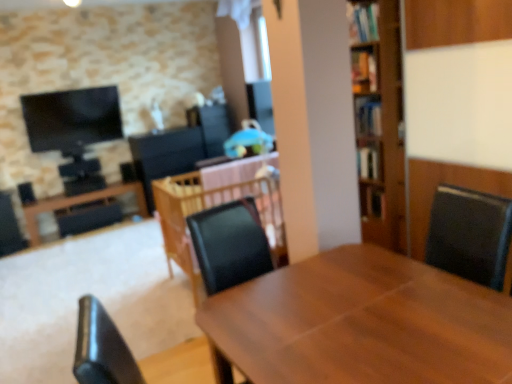
Question: Considering their positions, is wooden table at center, which is counted as the first table, starting from the right, located in front of or behind wooden table at center, placed as the 2th table when sorted from left to right?

Choices:
 (A) behind
 (B) front

Answer: (B)

Question: Considering the positions of wooden table at center, which is counted as the first table, starting from the right, and wooden table at center, the 2th table in the front-to-back sequence, in the image, is wooden table at center, which is counted as the first table, starting from the right, bigger or smaller than wooden table at center, the 2th table in the front-to-back sequence,?

Choices:
 (A) small
 (B) big

Answer: (B)

Question: Based on their relative distances, which object is farther from the wooden table at left, which ranks as the 1th table in left-to-right order?

Choices:
 (A) wooden table at center, the 2th table in the front-to-back sequence
 (B) wooden bookshelf at upper right, the 1th shelf positioned from the left
 (C) wooden table at center, marked as the 3th table in a back-to-front arrangement
 (D) wooden bookshelf at right, which ranks as the second shelf in left-to-right order

Answer: (C)

Question: Considering the real-world distances, which object is farthest from the wooden bookshelf at upper right, marked as the second shelf in a right-to-left arrangement?

Choices:
 (A) wooden table at center, the 2th table in the front-to-back sequence
 (B) wooden bookshelf at right, which ranks as the second shelf in left-to-right order
 (C) wooden table at left, which ranks as the 1th table in left-to-right order
 (D) wooden table at center, the first table viewed from the front

Answer: (C)